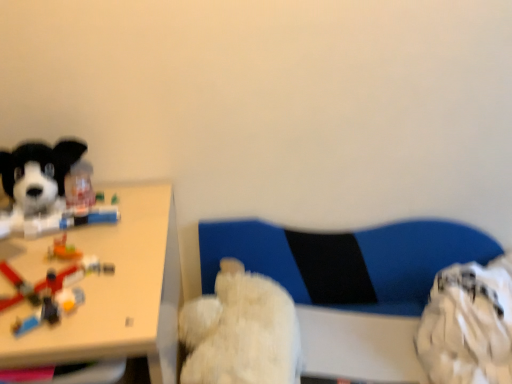
Question: Does fluffy white teddy bear at center, the second dog in the left-to-right sequence, come behind soft plush dog at left, the 1th dog when ordered from left to right?

Choices:
 (A) no
 (B) yes

Answer: (B)

Question: Is soft plush dog at left, which is the first dog in top-to-bottom order, a part of fluffy white teddy bear at center, the 1th dog positioned from the bottom?

Choices:
 (A) yes
 (B) no

Answer: (B)

Question: Does fluffy white teddy bear at center, the second dog in the left-to-right sequence, have a greater width compared to soft plush dog at left, which ranks as the second dog in right-to-left order?

Choices:
 (A) yes
 (B) no

Answer: (A)

Question: Can you confirm if fluffy white teddy bear at center, which is the 1th dog in right-to-left order, is positioned to the right of soft plush dog at left, the 1th dog when ordered from left to right?

Choices:
 (A) no
 (B) yes

Answer: (B)

Question: From the image's perspective, is fluffy white teddy bear at center, the second dog in the left-to-right sequence, under soft plush dog at left, the 1th dog when ordered from left to right?

Choices:
 (A) yes
 (B) no

Answer: (A)

Question: Considering the positions of point (51, 316) and point (253, 306), is point (51, 316) closer or farther from the camera than point (253, 306)?

Choices:
 (A) closer
 (B) farther

Answer: (A)

Question: From a real-world perspective, is translucent plastic toy at left positioned above or below fluffy white teddy bear at center, which is counted as the second dog, starting from the top?

Choices:
 (A) below
 (B) above

Answer: (B)

Question: Considering the positions of translucent plastic toy at left and fluffy white teddy bear at center, the 1th dog positioned from the bottom, in the image, is translucent plastic toy at left taller or shorter than fluffy white teddy bear at center, the 1th dog positioned from the bottom,?

Choices:
 (A) tall
 (B) short

Answer: (B)

Question: Is translucent plastic toy at left in front of or behind fluffy white teddy bear at center, the second dog in the left-to-right sequence, in the image?

Choices:
 (A) front
 (B) behind

Answer: (A)

Question: From a real-world perspective, relative to blue fabric swivel chair at center, is soft plush dog at left, which is counted as the 2th dog, starting from the bottom, vertically above or below?

Choices:
 (A) below
 (B) above

Answer: (B)

Question: Considering the relative positions of soft plush dog at left, which is the first dog in top-to-bottom order, and blue fabric swivel chair at center in the image provided, is soft plush dog at left, which is the first dog in top-to-bottom order, to the left or to the right of blue fabric swivel chair at center?

Choices:
 (A) left
 (B) right

Answer: (A)

Question: Is point (53, 231) positioned closer to the camera than point (264, 241)?

Choices:
 (A) closer
 (B) farther

Answer: (A)

Question: Considering the positions of soft plush dog at left, which is the first dog in top-to-bottom order, and blue fabric swivel chair at center in the image, is soft plush dog at left, which is the first dog in top-to-bottom order, wider or thinner than blue fabric swivel chair at center?

Choices:
 (A) wide
 (B) thin

Answer: (A)

Question: Would you say translucent plastic toy at left is inside or outside soft plush dog at left, the 1th dog when ordered from left to right?

Choices:
 (A) outside
 (B) inside

Answer: (A)

Question: Considering the positions of point (46, 314) and point (60, 218), is point (46, 314) closer or farther from the camera than point (60, 218)?

Choices:
 (A) farther
 (B) closer

Answer: (B)